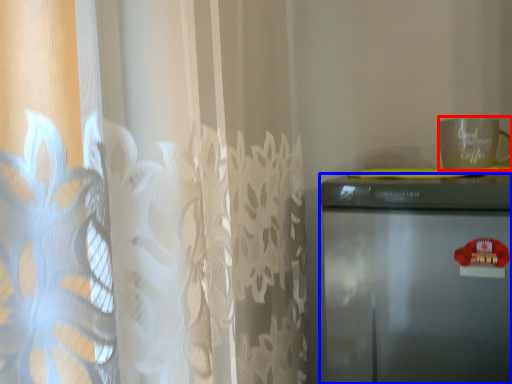
Question: Which point is closer to the camera, mug (highlighted by a red box) or refrigerator (highlighted by a blue box)?

Choices:
 (A) mug
 (B) refrigerator

Answer: (B)